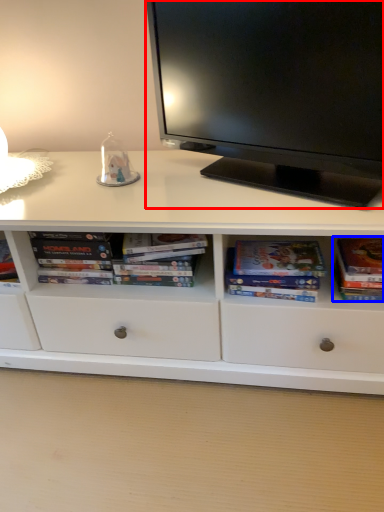
Question: Which point is further to the camera, television (highlighted by a red box) or paperback book (highlighted by a blue box)?

Choices:
 (A) television
 (B) paperback book

Answer: (B)